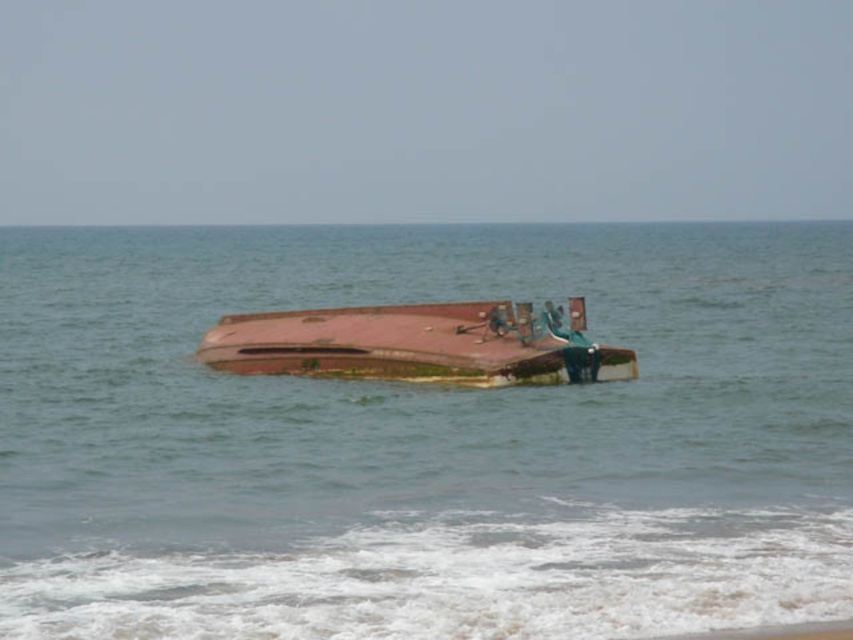
Question: Is green algae water at center smaller than rusty metal boat at center?

Choices:
 (A) yes
 (B) no

Answer: (B)

Question: Which point is closer to the camera?

Choices:
 (A) green algae water at center
 (B) rusty metal boat at center

Answer: (A)

Question: Which object appears farthest from the camera in this image?

Choices:
 (A) rusty metal boat at center
 (B) green algae water at center

Answer: (A)

Question: Does green algae water at center have a larger size compared to rusty metal boat at center?

Choices:
 (A) yes
 (B) no

Answer: (A)

Question: Is green algae water at center thinner than rusty metal boat at center?

Choices:
 (A) no
 (B) yes

Answer: (A)